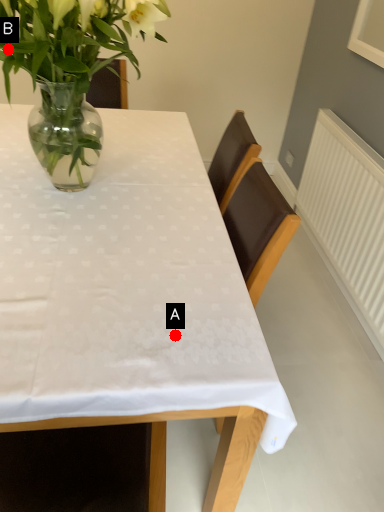
Question: Two points are circled on the image, labeled by A and B beside each circle. Which point is closer to the camera taking this photo?

Choices:
 (A) A is closer
 (B) B is closer

Answer: (A)